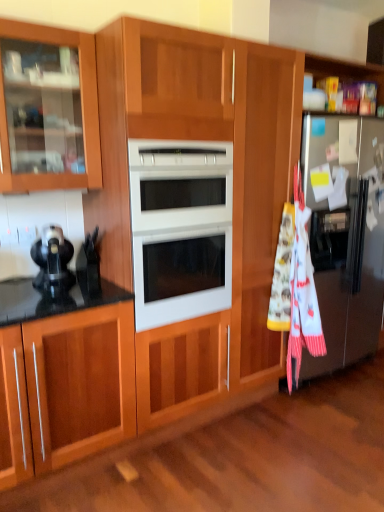
The image size is (384, 512). What do you see at coordinates (345, 234) in the screenshot?
I see `silver metallic refrigerator at right` at bounding box center [345, 234].

This screenshot has height=512, width=384. In order to click on silver metallic refrigerator at right in this screenshot , I will do `click(345, 234)`.

What's the angular difference between silver metallic refrigerator at right and white glossy microwave oven at center's facing directions?

silver metallic refrigerator at right and white glossy microwave oven at center are facing 0.963 degrees away from each other.

Is silver metallic refrigerator at right not near white glossy microwave oven at center?

silver metallic refrigerator at right is actually quite close to white glossy microwave oven at center.

From the image's perspective, is silver metallic refrigerator at right above or below white glossy microwave oven at center?

Based on their image positions, silver metallic refrigerator at right is located beneath white glossy microwave oven at center.

Is silver metallic refrigerator at right oriented towards white glossy microwave oven at center?

No, silver metallic refrigerator at right is not aimed at white glossy microwave oven at center.

How different are the orientations of white glossy microwave oven at center and matte black coffee maker at left in degrees?

The angular difference between white glossy microwave oven at center and matte black coffee maker at left is 12 degrees.

Looking at this image, is white glossy microwave oven at center not close to matte black coffee maker at left?

No, there isn't a large distance between white glossy microwave oven at center and matte black coffee maker at left.

Is white glossy microwave oven at center completely or partially outside of matte black coffee maker at left?

white glossy microwave oven at center lies outside matte black coffee maker at left's area.

From a real-world perspective, relative to matte black coffee maker at left, is white glossy microwave oven at center vertically above or below?

From a real-world perspective, white glossy microwave oven at center is physically above matte black coffee maker at left.

Considering the relative sizes of white cotton beach towel at right and white glossy microwave oven at center in the image provided, is white cotton beach towel at right taller than white glossy microwave oven at center?

Correct, white cotton beach towel at right is much taller as white glossy microwave oven at center.

Is white cotton beach towel at right looking in the opposite direction of white glossy microwave oven at center?

No, white cotton beach towel at right is not facing the opposite direction of white glossy microwave oven at center.

Is point (316, 335) positioned before point (183, 161)?

No, it is behind (183, 161).

Which of these two, white cotton beach towel at right or white glossy microwave oven at center, is bigger?

white glossy microwave oven at center is bigger.

From a real-world perspective, is white cotton beach towel at right beneath matte black coffee maker at left?

Yes, from a real-world perspective, white cotton beach towel at right is below matte black coffee maker at left.

Is white cotton beach towel at right in front of or behind matte black coffee maker at left in the image?

Clearly, white cotton beach towel at right is behind matte black coffee maker at left.

Is white cotton beach towel at right thinner than matte black coffee maker at left?

Yes.

Considering the points (310, 292) and (38, 282), which point is behind, point (310, 292) or point (38, 282)?

Point (310, 292)

From the image's perspective, is silver metallic refrigerator at right below matte black coffee maker at left?

No.

Considering the positions of point (302, 155) and point (45, 278), is point (302, 155) closer or farther from the camera than point (45, 278)?

Clearly, point (302, 155) is more distant from the camera than point (45, 278).

From a real-world perspective, relative to matte black coffee maker at left, is silver metallic refrigerator at right vertically above or below?

Clearly, from a real-world perspective, silver metallic refrigerator at right is below matte black coffee maker at left.

Locate an element on the screen. appliance lying below the silver metallic refrigerator at right (from the image's perspective) is located at coordinates (53, 261).

Is matte black coffee maker at left bigger than silver metallic refrigerator at right?

No, matte black coffee maker at left is not bigger than silver metallic refrigerator at right.

Is the surface of matte black coffee maker at left in direct contact with silver metallic refrigerator at right?

matte black coffee maker at left is not next to silver metallic refrigerator at right, and they're not touching.

Is point (38, 248) in front of point (353, 327)?

That is True.

Which is more to the right, matte black coffee maker at left or white glossy microwave oven at center?

Positioned to the right is white glossy microwave oven at center.

Is matte black coffee maker at left not near white glossy microwave oven at center?

That's not correct — matte black coffee maker at left is a little close to white glossy microwave oven at center.

Locate an element on the screen. The image size is (384, 512). appliance that appears below the white glossy microwave oven at center (from a real-world perspective) is located at coordinates (53, 261).

Image resolution: width=384 pixels, height=512 pixels. I want to click on refrigerator on the right of white glossy microwave oven at center, so click(345, 234).

Where is `microwave oven above the matte black coffee maker at left (from the image's perspective)`? The width and height of the screenshot is (384, 512). microwave oven above the matte black coffee maker at left (from the image's perspective) is located at coordinates (180, 229).

Estimate the real-world distances between objects in this image. Which object is closer to white glossy microwave oven at center, matte black coffee maker at left or white cotton beach towel at right?

matte black coffee maker at left is positioned closer to the anchor white glossy microwave oven at center.

Based on their spatial positions, is white glossy microwave oven at center or silver metallic refrigerator at right further from white cotton beach towel at right?

white glossy microwave oven at center.

When comparing their distances from white glossy microwave oven at center, does white cotton beach towel at right or silver metallic refrigerator at right seem further?

silver metallic refrigerator at right.

Estimate the real-world distances between objects in this image. Which object is closer to matte black coffee maker at left, silver metallic refrigerator at right or white glossy microwave oven at center?

Among the two, white glossy microwave oven at center is located nearer to matte black coffee maker at left.

Estimate the real-world distances between objects in this image. Which object is further from white cotton beach towel at right, silver metallic refrigerator at right or white glossy microwave oven at center?

white glossy microwave oven at center is positioned further to the anchor white cotton beach towel at right.

Considering their positions, is matte black coffee maker at left positioned further to white cotton beach towel at right than white glossy microwave oven at center?

matte black coffee maker at left is further to white cotton beach towel at right.

Looking at this image, looking at the image, which one is located further to matte black coffee maker at left, silver metallic refrigerator at right or white cotton beach towel at right?

silver metallic refrigerator at right lies further to matte black coffee maker at left than the other object.

Considering their positions, is matte black coffee maker at left positioned closer to white cotton beach towel at right than silver metallic refrigerator at right?

silver metallic refrigerator at right is positioned closer to the anchor white cotton beach towel at right.

This screenshot has height=512, width=384. Find the location of `microwave oven situated between matte black coffee maker at left and white cotton beach towel at right from left to right`. microwave oven situated between matte black coffee maker at left and white cotton beach towel at right from left to right is located at coordinates (180, 229).

I want to click on beach towel between matte black coffee maker at left and silver metallic refrigerator at right from left to right, so click(302, 293).

At what (x,y) coordinates should I click in order to perform the action: click on beach towel between white glossy microwave oven at center and silver metallic refrigerator at right in the horizontal direction. Please return your answer as a coordinate pair (x, y). The width and height of the screenshot is (384, 512). Looking at the image, I should click on (302, 293).

The image size is (384, 512). In order to click on microwave oven between matte black coffee maker at left and silver metallic refrigerator at right from left to right in this screenshot , I will do pyautogui.click(x=180, y=229).